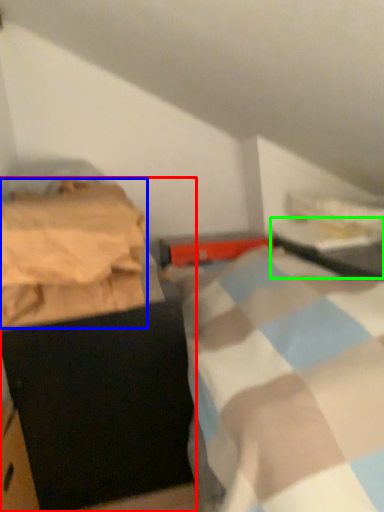
Question: Considering the real-world distances, which object is closest to furniture (highlighted by a red box)? blanket (highlighted by a blue box) or table (highlighted by a green box).

Choices:
 (A) blanket
 (B) table

Answer: (A)